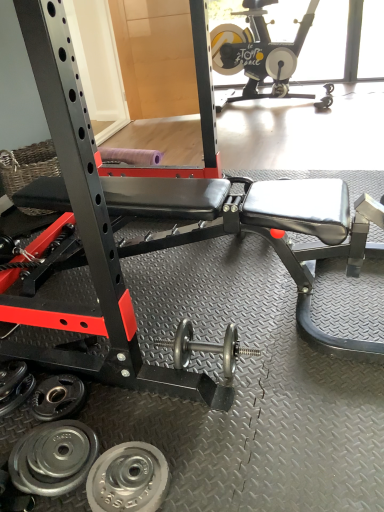
Where is `black matte stationary bike at upper right`? The image size is (384, 512). black matte stationary bike at upper right is located at coordinates tap(258, 52).

The width and height of the screenshot is (384, 512). What do you see at coordinates (258, 52) in the screenshot? I see `black matte stationary bike at upper right` at bounding box center [258, 52].

The width and height of the screenshot is (384, 512). Describe the element at coordinates (53, 458) in the screenshot. I see `silver metallic weight plate at lower left, which ranks as the second wheel in front-to-back order` at that location.

Image resolution: width=384 pixels, height=512 pixels. What are the coordinates of `silver metallic weight plate at lower left, which ranks as the first wheel in front-to-back order` in the screenshot? It's located at (128, 479).

How much space does silver metallic weight plate at lower left, arranged as the 3th wheel when viewed from the front, occupy vertically?

It is 1.63 inches.

Locate an element on the screen. The width and height of the screenshot is (384, 512). black matte stationary bike at upper right is located at coordinates (258, 52).

The width and height of the screenshot is (384, 512). Identify the location of wheel that is the 2nd one when counting downward from the black matte stationary bike at upper right (from the image's perspective). (53, 458).

Does point (217, 109) come behind point (87, 456)?

Yes, it is.

Could you measure the distance between black matte stationary bike at upper right and silver metallic weight plate at lower left, which ranks as the second wheel in back-to-front order?

12.09 feet.

Is black matte stationary bike at upper right oriented away from silver metallic weight plate at lower left, which ranks as the second wheel in front-to-back order?

black matte stationary bike at upper right does not have its back to silver metallic weight plate at lower left, which ranks as the second wheel in front-to-back order.

Which is less distant, (179, 360) or (139, 488)?

The point (139, 488) is in front.

Who is taller, polished silver dumbbell at center or silver metallic weight plate at lower left, which ranks as the first wheel in front-to-back order?

polished silver dumbbell at center.

How many degrees apart are the facing directions of polished silver dumbbell at center and silver metallic weight plate at lower left, the third wheel positioned from the back?

There is a 3.81-degree angle between the facing directions of polished silver dumbbell at center and silver metallic weight plate at lower left, the third wheel positioned from the back.

Is the position of polished silver dumbbell at center more distant than that of silver metallic weight plate at lower left, the third wheel positioned from the back?

Yes, the depth of polished silver dumbbell at center is greater than that of silver metallic weight plate at lower left, the third wheel positioned from the back.

Is the surface of silver metallic weight plate at lower left, which ranks as the second wheel in front-to-back order, in direct contact with black matte stationary bike at upper right?

silver metallic weight plate at lower left, which ranks as the second wheel in front-to-back order, and black matte stationary bike at upper right are clearly separated.

Considering the positions of point (91, 447) and point (258, 28), is point (91, 447) closer or farther from the camera than point (258, 28)?

Clearly, point (91, 447) is closer to the camera than point (258, 28).

From the image's perspective, is silver metallic weight plate at lower left, which ranks as the second wheel in back-to-front order, below black matte stationary bike at upper right?

Indeed, from the image's perspective, silver metallic weight plate at lower left, which ranks as the second wheel in back-to-front order, is shown beneath black matte stationary bike at upper right.

Can you confirm if black matte stationary bike at upper right is positioned to the left of silver metallic weight plate at lower left, which ranks as the first wheel in front-to-back order?

No.

From the image's perspective, does black matte stationary bike at upper right appear lower than silver metallic weight plate at lower left, the third wheel positioned from the back?

No, from the image's perspective, black matte stationary bike at upper right is not below silver metallic weight plate at lower left, the third wheel positioned from the back.

Considering the relative sizes of black matte stationary bike at upper right and silver metallic weight plate at lower left, which ranks as the first wheel in front-to-back order, in the image provided, is black matte stationary bike at upper right smaller than silver metallic weight plate at lower left, which ranks as the first wheel in front-to-back order,?

No, black matte stationary bike at upper right is not smaller than silver metallic weight plate at lower left, which ranks as the first wheel in front-to-back order.

From a real-world perspective, which object stands above the other?

From a 3D spatial view, black matte stationary bike at upper right is above.

Is point (234, 67) behind point (69, 391)?

That is True.

From a real-world perspective, is black matte stationary bike at upper right below silver metallic weight plate at lower left, arranged as the 3th wheel when viewed from the front?

No.

Is black matte stationary bike at upper right far from silver metallic weight plate at lower left, which ranks as the 1th wheel in back-to-front order?

That's right, there is a large distance between black matte stationary bike at upper right and silver metallic weight plate at lower left, which ranks as the 1th wheel in back-to-front order.

How many degrees apart are the facing directions of black matte stationary bike at upper right and silver metallic weight plate at lower left, which ranks as the 1th wheel in back-to-front order?

The angular difference between black matte stationary bike at upper right and silver metallic weight plate at lower left, which ranks as the 1th wheel in back-to-front order, is 84.4 degrees.

Consider the image. Does silver metallic weight plate at lower left, which ranks as the 1th wheel in back-to-front order, appear on the right side of black matte stationary bike at upper right?

No.

From the picture: Looking at their sizes, would you say silver metallic weight plate at lower left, arranged as the 3th wheel when viewed from the front, is wider or thinner than black matte stationary bike at upper right?

In the image, silver metallic weight plate at lower left, arranged as the 3th wheel when viewed from the front, appears to be more narrow than black matte stationary bike at upper right.

In the scene shown: Is silver metallic weight plate at lower left, which ranks as the 1th wheel in back-to-front order, positioned far away from black matte stationary bike at upper right?

Yes, silver metallic weight plate at lower left, which ranks as the 1th wheel in back-to-front order, and black matte stationary bike at upper right are quite far apart.

Is black matte stationary bike at upper right at the back of silver metallic weight plate at lower left, arranged as the 3th wheel when viewed from the front?

silver metallic weight plate at lower left, arranged as the 3th wheel when viewed from the front, is not turned away from black matte stationary bike at upper right.

From the image's perspective, is silver metallic weight plate at lower left, the third wheel positioned from the back, located above or below polished silver dumbbell at center?

From the image's perspective, silver metallic weight plate at lower left, the third wheel positioned from the back, appears below polished silver dumbbell at center.

Does silver metallic weight plate at lower left, which ranks as the first wheel in front-to-back order, turn towards polished silver dumbbell at center?

No, silver metallic weight plate at lower left, which ranks as the first wheel in front-to-back order, is not aimed at polished silver dumbbell at center.

Between silver metallic weight plate at lower left, which ranks as the first wheel in front-to-back order, and polished silver dumbbell at center, which one appears on the right side from the viewer's perspective?

From the viewer's perspective, polished silver dumbbell at center appears more on the right side.

Does silver metallic weight plate at lower left, which ranks as the first wheel in front-to-back order, have a larger size compared to polished silver dumbbell at center?

No, silver metallic weight plate at lower left, which ranks as the first wheel in front-to-back order, is not bigger than polished silver dumbbell at center.

Where is `sport equipment that appears above the silver metallic weight plate at lower left, which ranks as the second wheel in front-to-back order (from the image's perspective)`? The height and width of the screenshot is (512, 384). sport equipment that appears above the silver metallic weight plate at lower left, which ranks as the second wheel in front-to-back order (from the image's perspective) is located at coordinates (258, 52).

The height and width of the screenshot is (512, 384). What are the coordinates of `dumbbell behind the silver metallic weight plate at lower left, the third wheel positioned from the back` in the screenshot? It's located at (206, 347).

Looking at the image, which one is located further to silver metallic weight plate at lower left, which ranks as the 1th wheel in back-to-front order, black matte stationary bike at upper right or silver metallic weight plate at lower left, which ranks as the second wheel in front-to-back order?

black matte stationary bike at upper right is positioned further to the anchor silver metallic weight plate at lower left, which ranks as the 1th wheel in back-to-front order.

Considering their positions, is silver metallic weight plate at lower left, the third wheel positioned from the back, positioned closer to silver metallic weight plate at lower left, arranged as the 3th wheel when viewed from the front, than polished silver dumbbell at center?

Among the two, silver metallic weight plate at lower left, the third wheel positioned from the back, is located nearer to silver metallic weight plate at lower left, arranged as the 3th wheel when viewed from the front.

Based on their spatial positions, is polished silver dumbbell at center or silver metallic weight plate at lower left, which ranks as the first wheel in front-to-back order, closer to silver metallic weight plate at lower left, which ranks as the second wheel in back-to-front order?

silver metallic weight plate at lower left, which ranks as the first wheel in front-to-back order, is positioned closer to the anchor silver metallic weight plate at lower left, which ranks as the second wheel in back-to-front order.

Based on their spatial positions, is polished silver dumbbell at center or black matte stationary bike at upper right further from silver metallic weight plate at lower left, the third wheel positioned from the back?

black matte stationary bike at upper right.

Looking at the image, which one is located closer to silver metallic weight plate at lower left, the third wheel positioned from the back, black matte stationary bike at upper right or polished silver dumbbell at center?

The object closer to silver metallic weight plate at lower left, the third wheel positioned from the back, is polished silver dumbbell at center.

Looking at the image, which one is located further to silver metallic weight plate at lower left, which ranks as the second wheel in back-to-front order, black matte stationary bike at upper right or polished silver dumbbell at center?

black matte stationary bike at upper right.

From the image, which object appears to be farther from black matte stationary bike at upper right, silver metallic weight plate at lower left, arranged as the 3th wheel when viewed from the front, or silver metallic weight plate at lower left, the third wheel positioned from the back?

silver metallic weight plate at lower left, the third wheel positioned from the back, lies further to black matte stationary bike at upper right than the other object.

Consider the image. Considering their positions, is silver metallic weight plate at lower left, which ranks as the second wheel in front-to-back order, positioned closer to silver metallic weight plate at lower left, which ranks as the 1th wheel in back-to-front order, than polished silver dumbbell at center?

silver metallic weight plate at lower left, which ranks as the second wheel in front-to-back order, is closer to silver metallic weight plate at lower left, which ranks as the 1th wheel in back-to-front order.

At what (x,y) coordinates should I click in order to perform the action: click on dumbbell that lies between black matte stationary bike at upper right and silver metallic weight plate at lower left, which ranks as the 1th wheel in back-to-front order, from top to bottom. Please return your answer as a coordinate pair (x, y). The image size is (384, 512). Looking at the image, I should click on (206, 347).

Locate an element on the screen. This screenshot has width=384, height=512. wheel between silver metallic weight plate at lower left, which ranks as the second wheel in back-to-front order, and polished silver dumbbell at center is located at coordinates [x=128, y=479].

At what (x,y) coordinates should I click in order to perform the action: click on dumbbell between black matte stationary bike at upper right and silver metallic weight plate at lower left, which ranks as the second wheel in back-to-front order, in the vertical direction. Please return your answer as a coordinate pair (x, y). This screenshot has height=512, width=384. Looking at the image, I should click on coord(206,347).

I want to click on wheel between black matte stationary bike at upper right and silver metallic weight plate at lower left, which ranks as the second wheel in back-to-front order, in the up-down direction, so click(x=58, y=397).